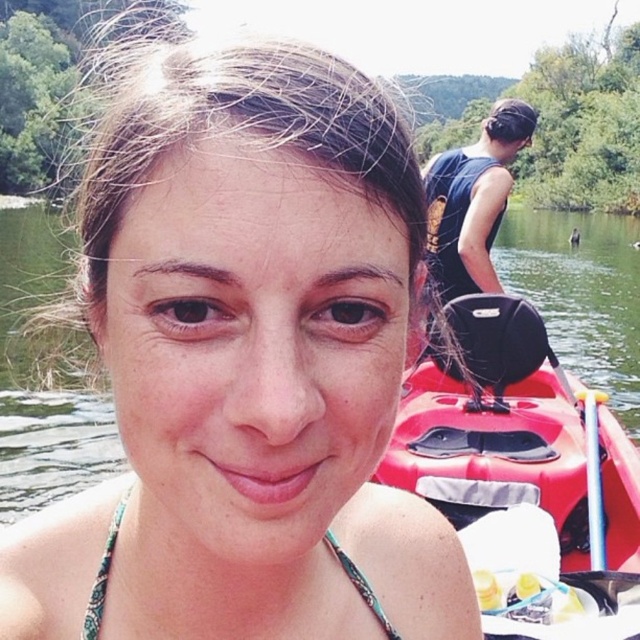
Question: Which point appears closest to the camera in this image?

Choices:
 (A) click(x=582, y=397)
 (B) click(x=333, y=556)

Answer: (B)

Question: From the image, what is the correct spatial relationship of matte black swimsuit at center in relation to silver metallic paddle at upper right?

Choices:
 (A) left
 (B) right

Answer: (A)

Question: Does matte black swimsuit at center have a larger size compared to silver metallic paddle at upper right?

Choices:
 (A) yes
 (B) no

Answer: (A)

Question: Is green printed bikini top at center further to the viewer compared to silver metallic paddle at upper right?

Choices:
 (A) no
 (B) yes

Answer: (A)

Question: Based on their relative distances, which object is nearer to the silver metallic paddle at upper right?

Choices:
 (A) matte black swimsuit at center
 (B) green printed bikini top at center

Answer: (B)

Question: Which object appears farthest from the camera in this image?

Choices:
 (A) matte black swimsuit at center
 (B) silver metallic paddle at upper right

Answer: (B)